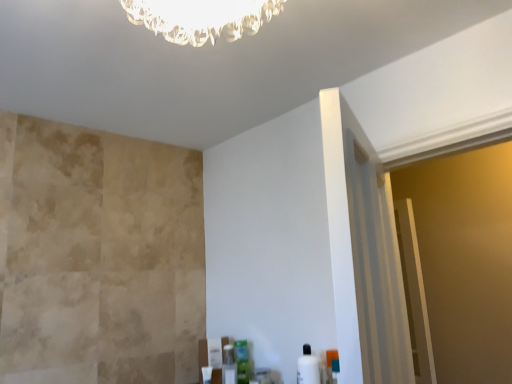
Question: Which direction should I rotate to face green plastic container at lower center, placed as the 2th toiletry when sorted from back to front, — up or down?

Choices:
 (A) up
 (B) down

Answer: (B)

Question: Does clear plastic bottle at lower center, the first toiletry viewed from the back, have a greater height compared to white glossy bottle at lower right, the third toiletry in the left-to-right sequence?

Choices:
 (A) no
 (B) yes

Answer: (A)

Question: From a real-world perspective, is clear plastic bottle at lower center, the first toiletry viewed from the back, on white glossy bottle at lower right, the third toiletry in the left-to-right sequence?

Choices:
 (A) no
 (B) yes

Answer: (A)

Question: From a real-world perspective, is clear plastic bottle at lower center, the 3th toiletry when ordered from front to back, positioned under white glossy bottle at lower right, the third toiletry in the left-to-right sequence, based on gravity?

Choices:
 (A) yes
 (B) no

Answer: (A)

Question: From the image's perspective, is clear plastic bottle at lower center, the third toiletry viewed from the right, on top of white glossy bottle at lower right, the third toiletry in the left-to-right sequence?

Choices:
 (A) no
 (B) yes

Answer: (A)

Question: Is clear plastic bottle at lower center, the first toiletry viewed from the back, oriented towards white glossy bottle at lower right, the 1th toiletry when ordered from right to left?

Choices:
 (A) no
 (B) yes

Answer: (A)

Question: Is clear plastic bottle at lower center, the third toiletry viewed from the right, positioned far away from white glossy bottle at lower right, the 1th toiletry positioned from the front?

Choices:
 (A) yes
 (B) no

Answer: (B)

Question: Can you confirm if clear plastic bottle at lower center, the third toiletry viewed from the right, is positioned to the right of green plastic container at lower center, which appears as the 2th toiletry when viewed from the right?

Choices:
 (A) yes
 (B) no

Answer: (B)

Question: Is clear plastic bottle at lower center, the first toiletry in the left-to-right sequence, further to the viewer compared to green plastic container at lower center, which is the second toiletry from left to right?

Choices:
 (A) yes
 (B) no

Answer: (A)

Question: Is green plastic container at lower center, placed as the 2th toiletry when sorted from back to front, located within clear plastic bottle at lower center, the third toiletry viewed from the right?

Choices:
 (A) no
 (B) yes

Answer: (A)

Question: Can you confirm if clear plastic bottle at lower center, the first toiletry viewed from the back, is thinner than green plastic container at lower center, placed as the 2th toiletry when sorted from back to front?

Choices:
 (A) yes
 (B) no

Answer: (A)

Question: Is clear plastic bottle at lower center, the first toiletry viewed from the back, to the left of green plastic container at lower center, placed as the 2th toiletry when sorted from back to front, from the viewer's perspective?

Choices:
 (A) yes
 (B) no

Answer: (A)

Question: Is clear plastic bottle at lower center, the first toiletry in the left-to-right sequence, facing away from green plastic container at lower center, placed as the 2th toiletry when sorted from back to front?

Choices:
 (A) no
 (B) yes

Answer: (A)

Question: Is white glossy bottle at lower right, which ranks as the 3th toiletry in back-to-front order, oriented towards clear plastic bottle at lower center, the first toiletry in the left-to-right sequence?

Choices:
 (A) yes
 (B) no

Answer: (B)